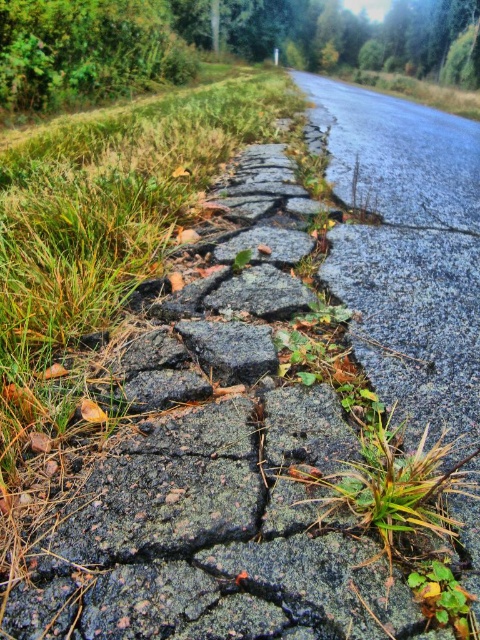
You are a gardener trying to maintain the area between the green grass at center and the black rough stone at center. If your gardening tool has a maximum reach of 14 inches, can you comfortably work between them without moving either object?

The distance between the green grass at center and the black rough stone at center is 14.49 inches, which is slightly beyond the tool reach of 14 inches. You may need to adjust your position or use a longer tool to comfortably work between them.

Based on the photo, you are a gardener trying to determine which area to prioritize for maintenance between the green grass at center and the dark gray rough stone at center. Based on their sizes, which one requires more attention?

The green grass at center has a larger size compared to the dark gray rough stone at center, so it requires more attention as it may need more resources like water or nutrients to maintain its health.